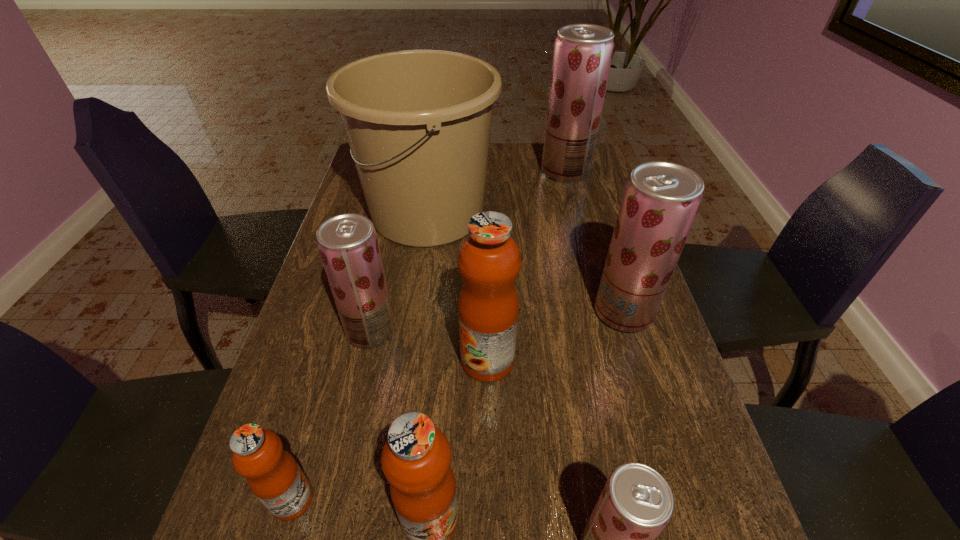
The height and width of the screenshot is (540, 960). I want to click on vacant space at the far edge, so click(528, 173).

Image resolution: width=960 pixels, height=540 pixels. I want to click on vacant position at the left edge of the desktop, so [x=291, y=375].

Where is `vacant space at the right edge of the desktop`? vacant space at the right edge of the desktop is located at coordinates tap(645, 388).

The width and height of the screenshot is (960, 540). Find the location of `free spot between the third smallest strawberry fruit juice and the smallest orange fruit juice`. free spot between the third smallest strawberry fruit juice and the smallest orange fruit juice is located at coordinates (458, 406).

In order to click on unoccupied area between the tallest fruit juice and the beige bucket in this screenshot , I will do `click(496, 193)`.

You are a GUI agent. You are given a task and a screenshot of the screen. Output one action in this format:
    pyautogui.click(x=<x>, y=<y>)
    Task: Click on the free space between the beige bucket and the leftmost orange fruit juice
    The image size is (960, 540).
    Given the screenshot: What is the action you would take?
    pyautogui.click(x=360, y=356)

Where is `vacant area between the farthest fruit juice and the leftmost orange fruit juice`? This screenshot has height=540, width=960. vacant area between the farthest fruit juice and the leftmost orange fruit juice is located at coordinates click(429, 335).

At what (x,y) coordinates should I click in order to perform the action: click on vacant space that is in between the biggest orange fruit juice and the tallest fruit juice. Please return your answer as a coordinate pair (x, y). The height and width of the screenshot is (540, 960). Looking at the image, I should click on (526, 266).

Identify the location of vacant point located between the leftmost orange fruit juice and the beige bucket. The image size is (960, 540). (360, 356).

Where is `unoccupied area between the smallest orange fruit juice and the farthest fruit juice`? The image size is (960, 540). unoccupied area between the smallest orange fruit juice and the farthest fruit juice is located at coordinates (429, 335).